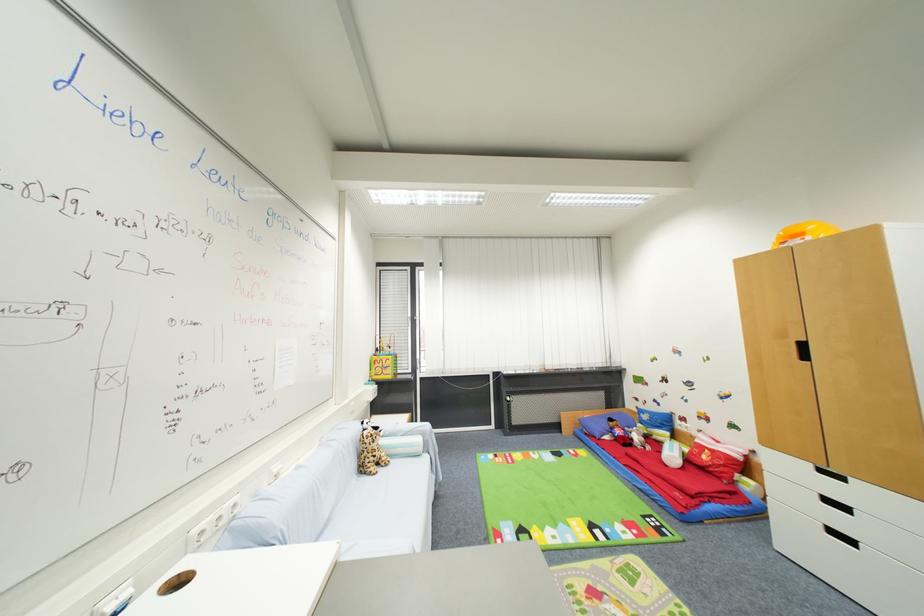
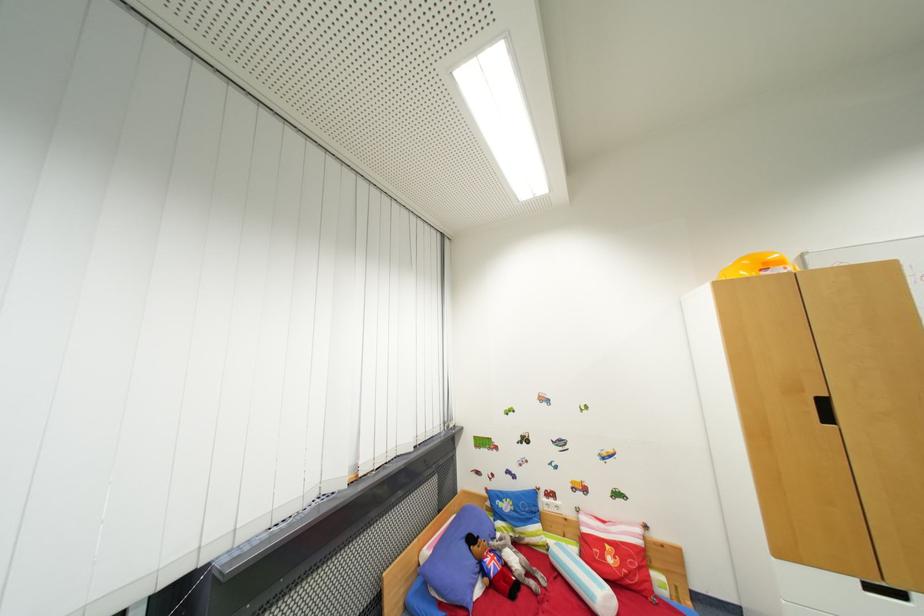
Where in the second image is the point corresponding to (710,459) from the first image?

(614, 562)